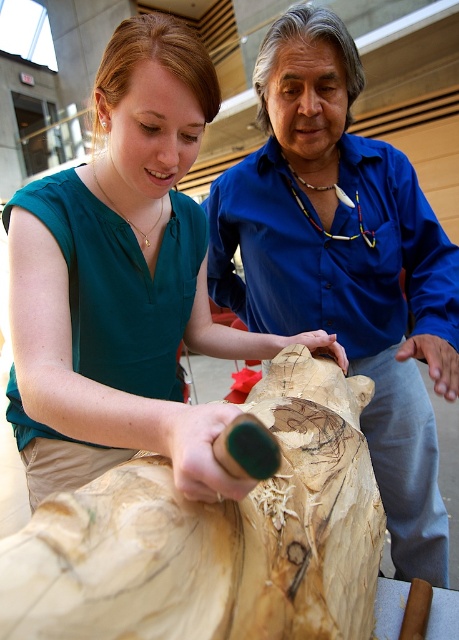
You are a tailor who needs to determine which shirt between the teal fabric shirt at center and the blue smooth shirt at center has a smaller width to fit into a narrow display case. Based on the scene, which one should you choose?

The teal fabric shirt at center has a smaller width than the blue smooth shirt at center, so it should be chosen for the narrow display case.

You are a drone operator trying to fly a drone between two points in the image. The first point is labeled as point (29, 353) and the second point is labeled as point (388, 288). According to the scene description, which point is closer to the drone operator?

Point (29, 353) is in front of point (388, 288), so the point closer to the drone operator is point (29, 353).